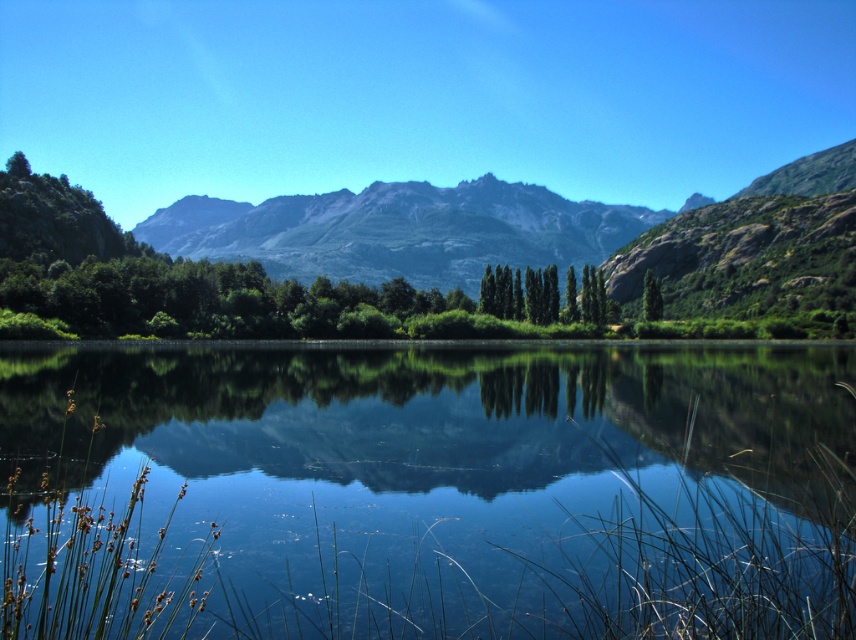
Question: Which of the following is the closest to the observer?

Choices:
 (A) green glossy tree at center
 (B) green smooth trees at center
 (C) transparent water at center

Answer: (C)

Question: Does transparent water at center appear on the right side of green glossy tree at center?

Choices:
 (A) yes
 (B) no

Answer: (B)

Question: Which of the following is the closest to the observer?

Choices:
 (A) (194, 467)
 (B) (643, 307)
 (C) (530, 273)

Answer: (A)

Question: Considering the relative positions of transparent water at center and green glossy tree at center in the image provided, where is transparent water at center located with respect to green glossy tree at center?

Choices:
 (A) below
 (B) above

Answer: (A)

Question: Can you confirm if green rocky mountain range at center is wider than green smooth trees at center?

Choices:
 (A) no
 (B) yes

Answer: (B)

Question: Which object appears closest to the camera in this image?

Choices:
 (A) green rocky mountain range at center
 (B) transparent water at center

Answer: (B)